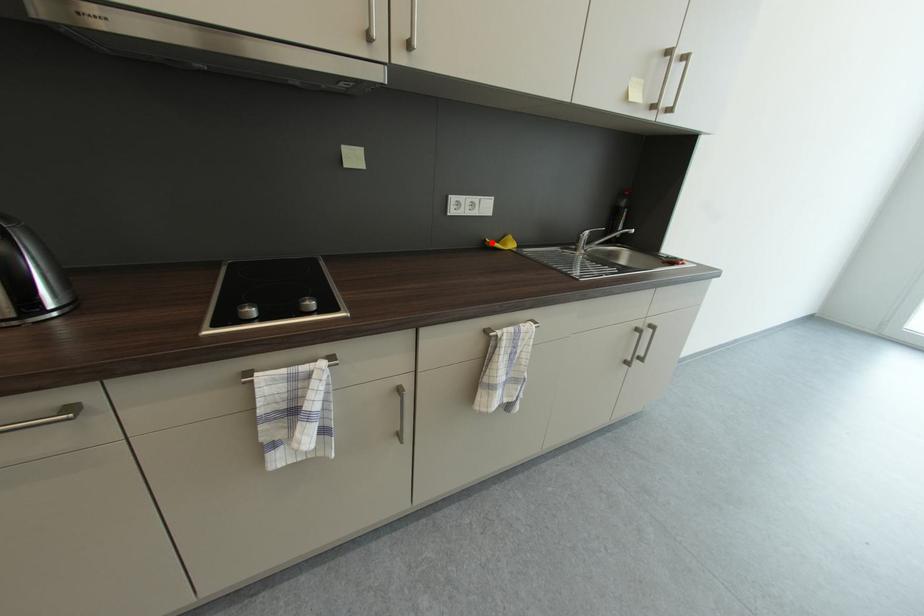
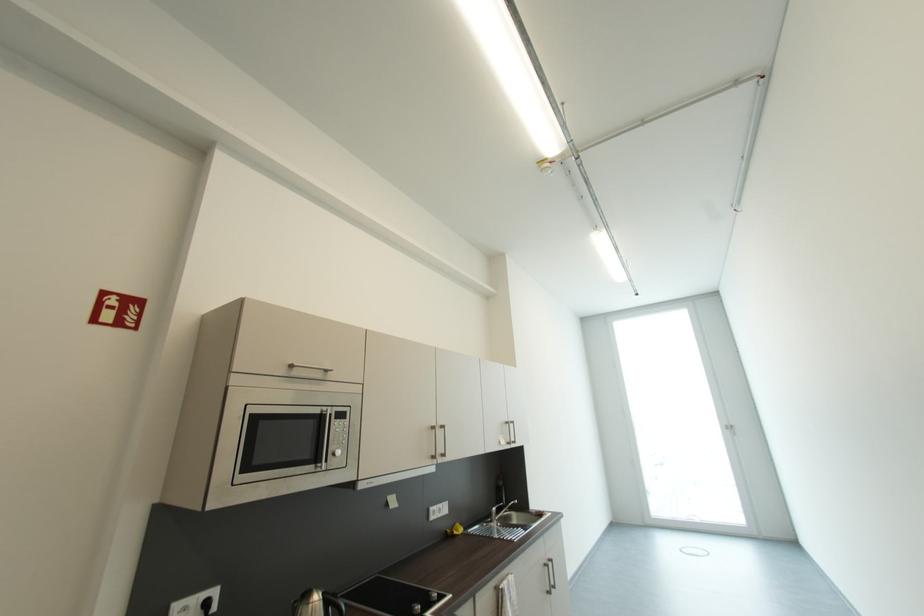
Question: I am providing you with two images of the same scene from different viewpoints. Given a red point in image1, look at the same physical point in image2. Is it:

Choices:
 (A) Closer to the viewpoint
 (B) Farther from the viewpoint

Answer: (B)